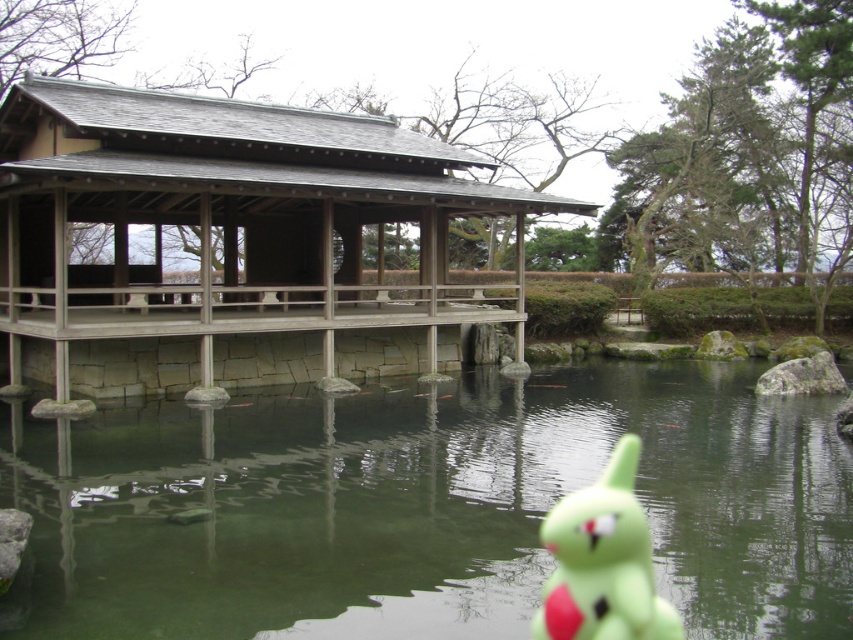
You are a visitor at the pavilion and want to place a new decorative item between the green translucent water at center and the green rubber toy at lower right. Considering their widths, which object should you place closer to the center to maintain balance?

Since the green translucent water at center is wider than the green rubber toy at lower right, you should place the new decorative item closer to the green rubber toy at lower right to balance their widths.